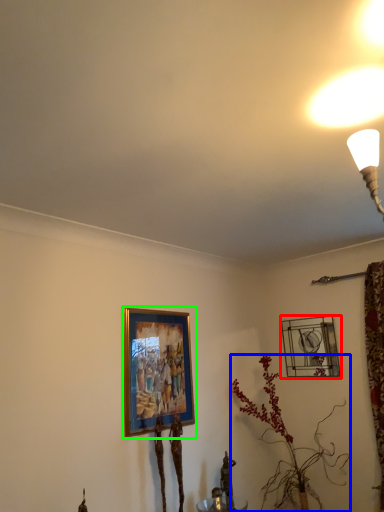
Question: Which is farther away from picture frame (highlighted by a red box)? houseplant (highlighted by a blue box) or picture frame (highlighted by a green box)?

Choices:
 (A) houseplant
 (B) picture frame

Answer: (B)